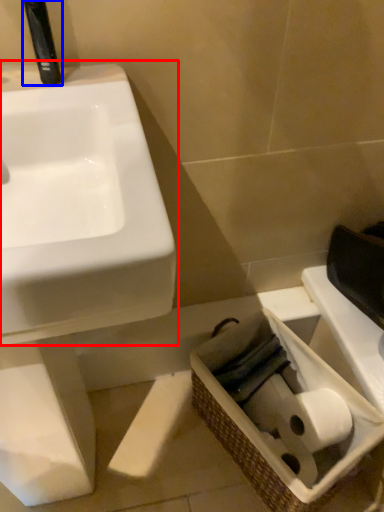
Question: Which object appears closest to the camera in this image, sink (highlighted by a red box) or plumbing fixture (highlighted by a blue box)?

Choices:
 (A) sink
 (B) plumbing fixture

Answer: (A)